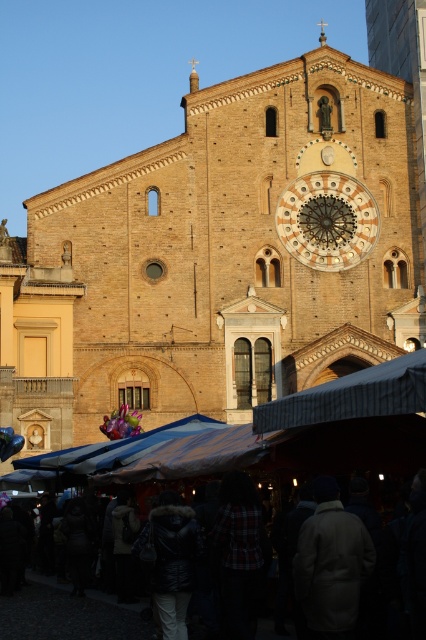
Looking at this image, measure the distance from white wool coat at lower right to gray striped canopy at center.

The distance of white wool coat at lower right from gray striped canopy at center is 8.53 meters.

Who is lower down, white wool coat at lower right or gray striped canopy at center?

white wool coat at lower right is below.

Between point (342, 522) and point (389, 365), which one is positioned behind?

Point (389, 365)

I want to click on white wool coat at lower right, so click(x=331, y=564).

From the picture: How distant is golden textured clock at center from dark woolen coat at lower center?

golden textured clock at center is 32.32 meters from dark woolen coat at lower center.

How much distance is there between golden textured clock at center and dark woolen coat at lower center?

A distance of 32.32 meters exists between golden textured clock at center and dark woolen coat at lower center.

Who is more distant from viewer, (345, 202) or (103, 616)?

Positioned behind is point (345, 202).

Find the location of `golden textured clock at center`. golden textured clock at center is located at coordinates (327, 220).

Is gray striped canopy at center further to camera compared to black fur-lined coat at center?

No, gray striped canopy at center is in front of black fur-lined coat at center.

Does point (397, 401) lie in front of point (154, 545)?

Yes, it is.

Does point (420, 397) come closer to viewer compared to point (181, 538)?

That is True.

Locate an element on the screen. The image size is (426, 640). gray striped canopy at center is located at coordinates (351, 396).